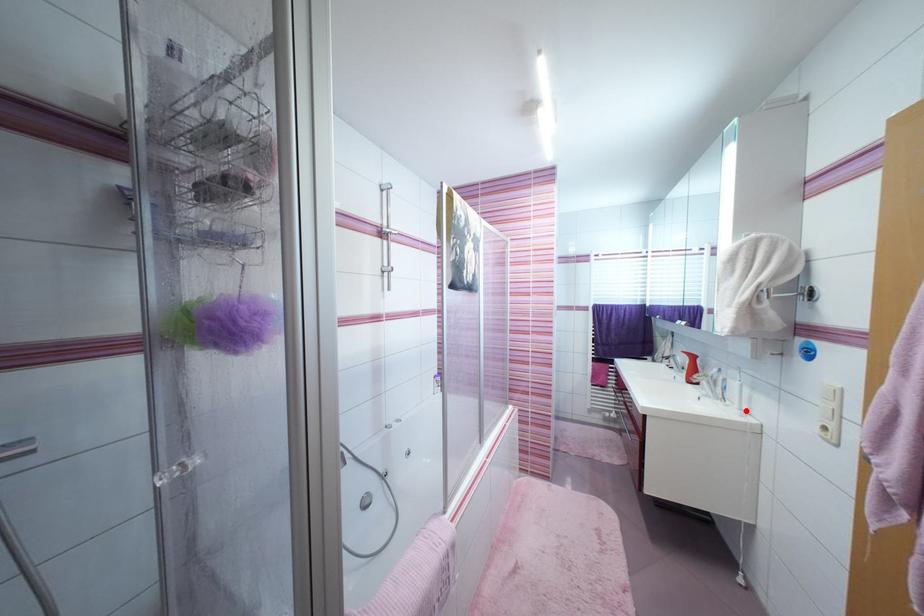
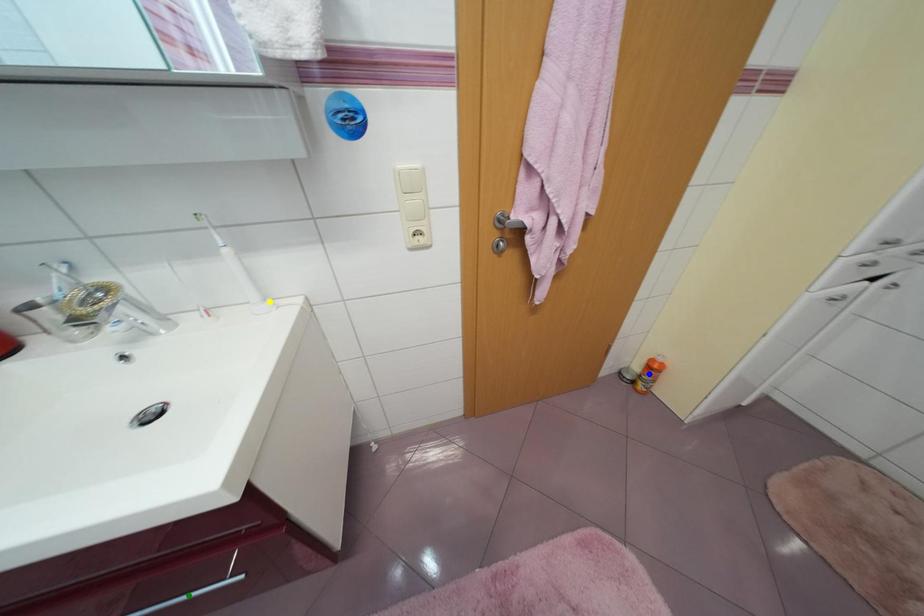
Question: I am providing you with two images of the same scene from different viewpoints. A red point is marked on the first image. You are given multiple points on the second image. Can you choose the point in image 2 that corresponds to the point in image 1?

Choices:
 (A) yellow point
 (B) green point
 (C) blue point

Answer: (A)